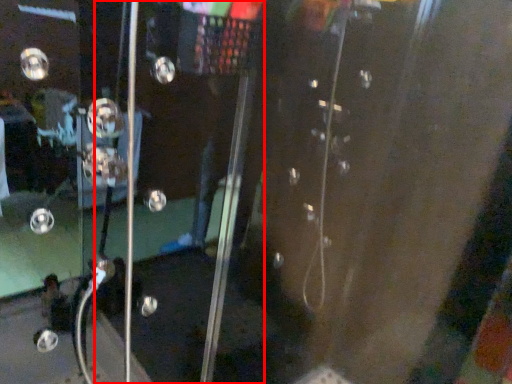
Question: Where is screen door (annotated by the red box) located in relation to knob in the image?

Choices:
 (A) right
 (B) left

Answer: (A)